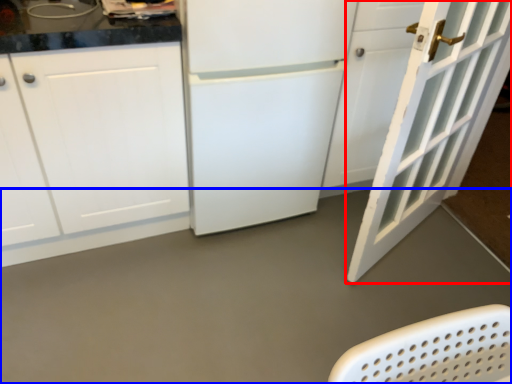
Question: Which object is closer to the camera taking this photo, door (highlighted by a red box) or concrete (highlighted by a blue box)?

Choices:
 (A) door
 (B) concrete

Answer: (A)